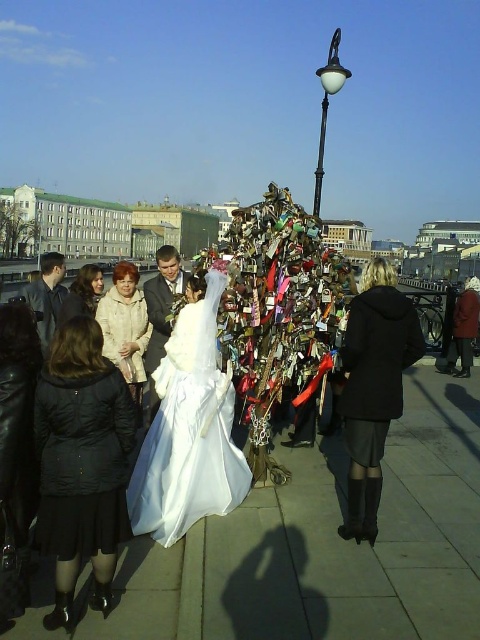
Which is in front, point (364, 298) or point (149, 417)?

Point (364, 298)

Measure the distance between black matte coat at center and camera.

black matte coat at center is 43.45 meters from camera.

Is point (382, 403) more distant than point (186, 284)?

No.

You are a GUI agent. You are given a task and a screenshot of the screen. Output one action in this format:
    pyautogui.click(x=<x>, y=<y>)
    Task: Click on the black matte coat at center
    This screenshot has width=480, height=640.
    Given the screenshot: What is the action you would take?
    pyautogui.click(x=373, y=387)

Does dark blue padded coat at lower left appear on the left side of satin suit at center?

In fact, dark blue padded coat at lower left is to the right of satin suit at center.

I want to click on dark blue padded coat at lower left, so [x=82, y=461].

Between black matte coat at center and dark gray suit at left, which one appears on the left side from the viewer's perspective?

dark gray suit at left is more to the left.

From the picture: Between black matte coat at center and dark gray suit at left, which one has less height?

black matte coat at center

The width and height of the screenshot is (480, 640). What are the coordinates of `black matte coat at center` in the screenshot? It's located at (373, 387).

You are a GUI agent. You are given a task and a screenshot of the screen. Output one action in this format:
    pyautogui.click(x=<x>, y=<y>)
    Task: Click on the black matte coat at center
    Image resolution: width=480 pixels, height=640 pixels.
    Given the screenshot: What is the action you would take?
    pyautogui.click(x=373, y=387)